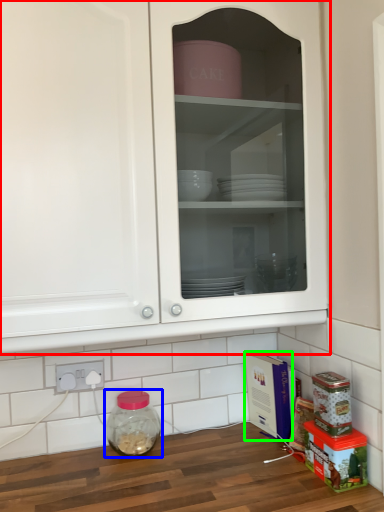
Question: Which object is positioned closest to cabinetry (highlighted by a red box)? Select from glass jar (highlighted by a blue box) and cardboard box (highlighted by a green box).

Choices:
 (A) glass jar
 (B) cardboard box

Answer: (A)